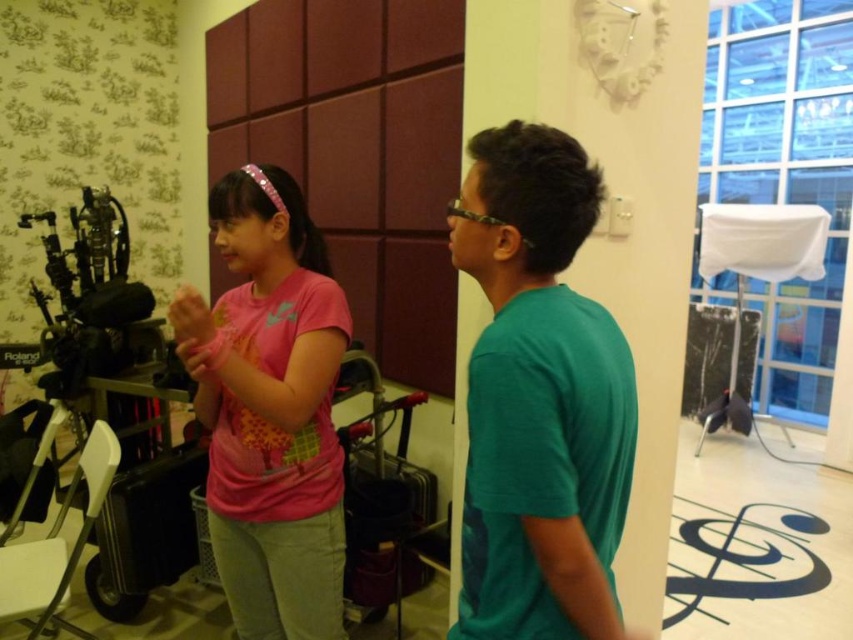
You are standing in the room and want to move from the point at coordinates point (538, 246) to the point at coordinates point (310, 474). Which direction should you move in to get there?

To move from point (538, 246) to point (310, 474), you should move towards the lower right direction since point (538, 246) is in front of point (310, 474).